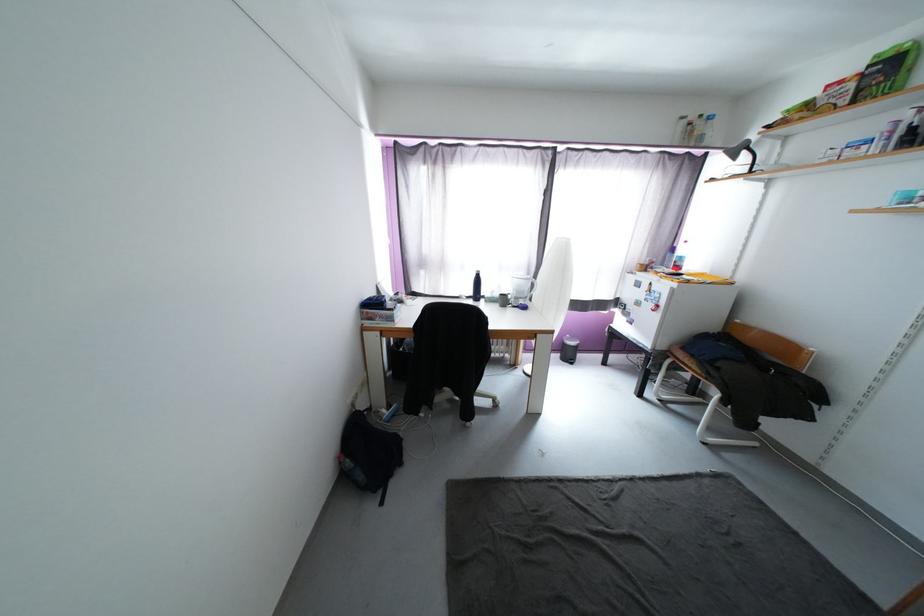
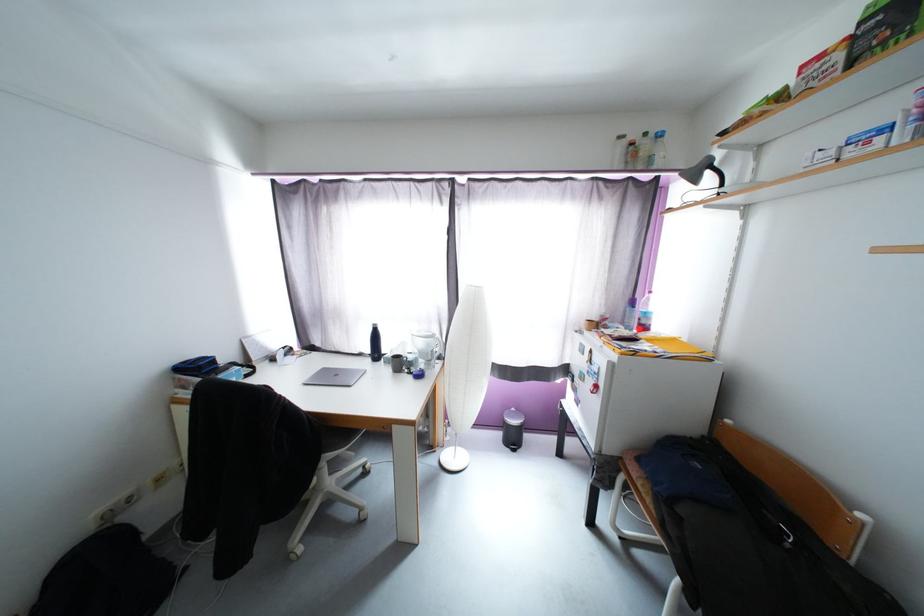
Find the pixel in the second image that matches (723,366) in the first image.

(687, 512)